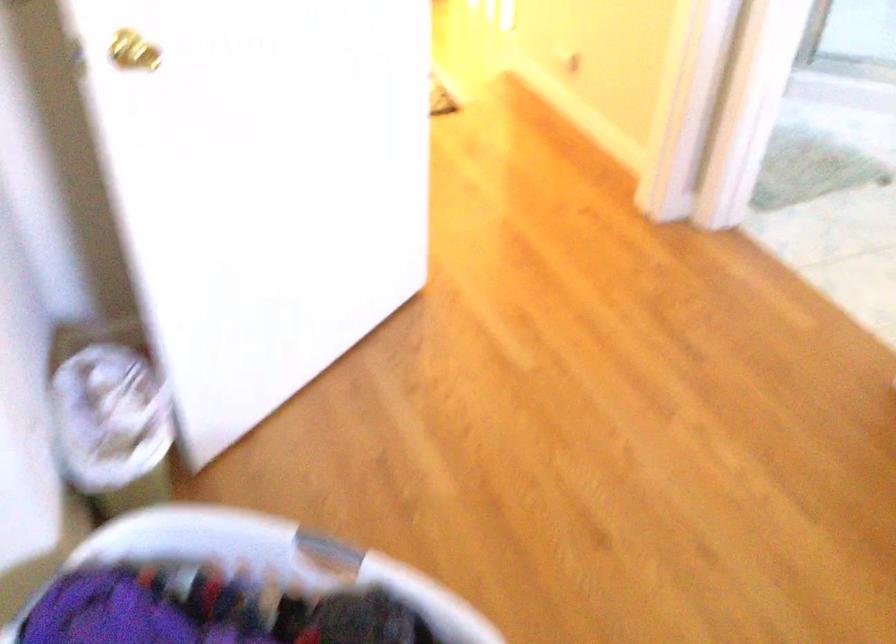
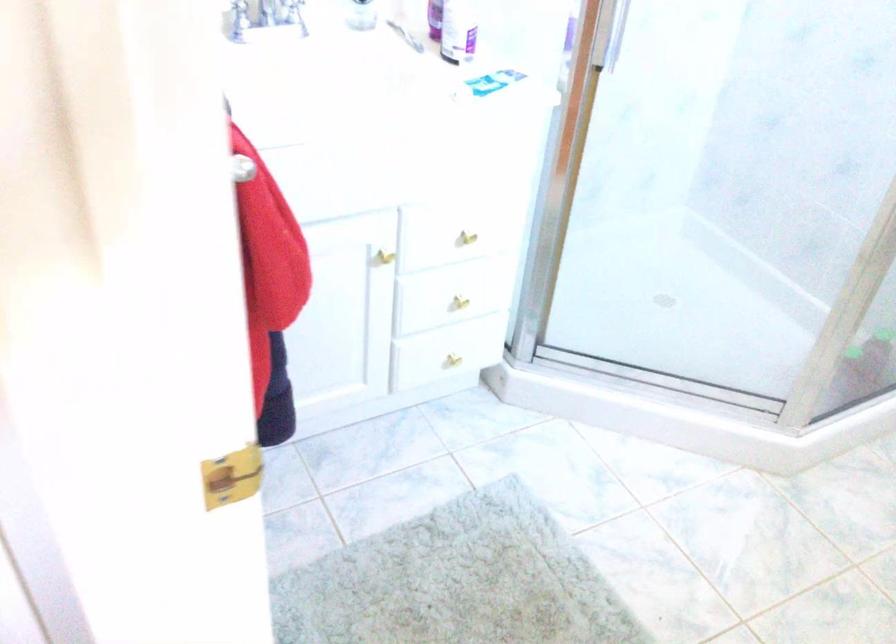
Which direction would the cameraman need to move to produce the second image?

The cameraman moved toward right, forward.